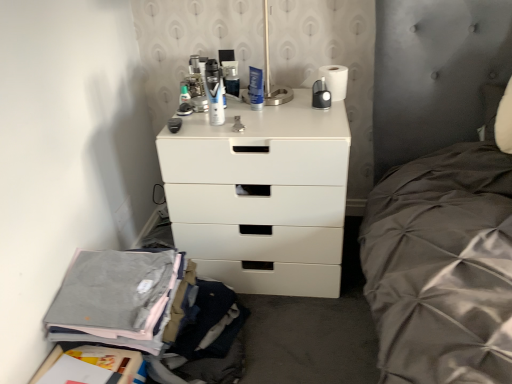
Find the location of a particular element. The height and width of the screenshot is (384, 512). vacant space that's between matte black shaving cream can at center, acting as the 3th toiletry starting from the back, and metallic silver can at center, the first toiletry from the back is located at coordinates (223, 110).